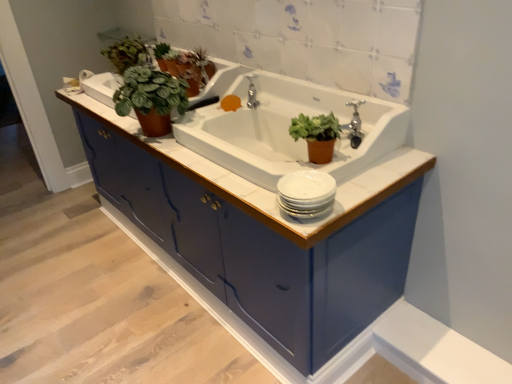
I want to click on unoccupied region to the right of matte brown pot at center, which is the 3th houseplant from left to right, so click(379, 168).